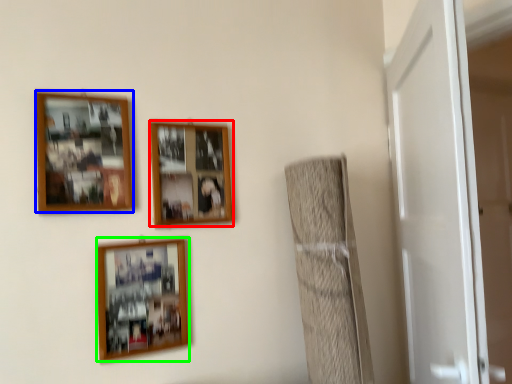
Question: Estimate the real-world distances between objects in this image. Which object is farther from picture frame (highlighted by a red box), picture frame (highlighted by a blue box) or picture frame (highlighted by a green box)?

Choices:
 (A) picture frame
 (B) picture frame

Answer: (B)